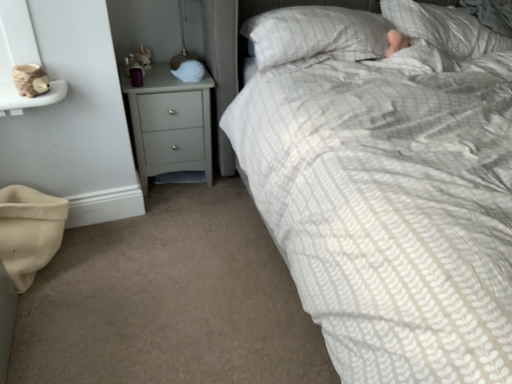
Question: Are white textured pillow at upper right, positioned as the second pillow in left-to-right order, and matte gray chest of drawers at center-left beside each other?

Choices:
 (A) yes
 (B) no

Answer: (B)

Question: Is matte gray chest of drawers at center-left surrounded by white textured pillow at upper right, arranged as the first pillow when viewed from the right?

Choices:
 (A) yes
 (B) no

Answer: (B)

Question: Is white textured pillow at upper right, arranged as the first pillow when viewed from the right, oriented away from matte gray chest of drawers at center-left?

Choices:
 (A) yes
 (B) no

Answer: (B)

Question: Does white textured pillow at upper right, positioned as the second pillow in left-to-right order, have a greater height compared to matte gray chest of drawers at center-left?

Choices:
 (A) no
 (B) yes

Answer: (A)

Question: Does white textured pillow at upper right, arranged as the first pillow when viewed from the right, have a smaller size compared to matte gray chest of drawers at center-left?

Choices:
 (A) yes
 (B) no

Answer: (B)

Question: Is white textured pillow at upper right, arranged as the first pillow when viewed from the right, further to camera compared to matte gray chest of drawers at center-left?

Choices:
 (A) yes
 (B) no

Answer: (B)

Question: Is matte gray chest of drawers at center-left not within white textured pillow at upper right, positioned as the second pillow in left-to-right order?

Choices:
 (A) yes
 (B) no

Answer: (A)

Question: Is white textured pillow at upper right, arranged as the first pillow when viewed from the right, surrounded by matte gray chest of drawers at center-left?

Choices:
 (A) no
 (B) yes

Answer: (A)

Question: Considering the relative sizes of matte gray chest of drawers at center-left and white textured pillow at upper right, arranged as the first pillow when viewed from the right, in the image provided, is matte gray chest of drawers at center-left smaller than white textured pillow at upper right, arranged as the first pillow when viewed from the right,?

Choices:
 (A) yes
 (B) no

Answer: (A)

Question: Does matte gray chest of drawers at center-left have a lesser height compared to white textured pillow at upper right, positioned as the second pillow in left-to-right order?

Choices:
 (A) yes
 (B) no

Answer: (B)

Question: Is matte gray chest of drawers at center-left bigger than white textured pillow at upper right, arranged as the first pillow when viewed from the right?

Choices:
 (A) no
 (B) yes

Answer: (A)

Question: Considering the relative sizes of matte gray chest of drawers at center-left and white textured pillow at upper right, arranged as the first pillow when viewed from the right, in the image provided, is matte gray chest of drawers at center-left wider than white textured pillow at upper right, arranged as the first pillow when viewed from the right,?

Choices:
 (A) yes
 (B) no

Answer: (B)

Question: Is matte gray chest of drawers at center-left next to white textured pillow at upper center, arranged as the 1th pillow when viewed from the left?

Choices:
 (A) no
 (B) yes

Answer: (A)